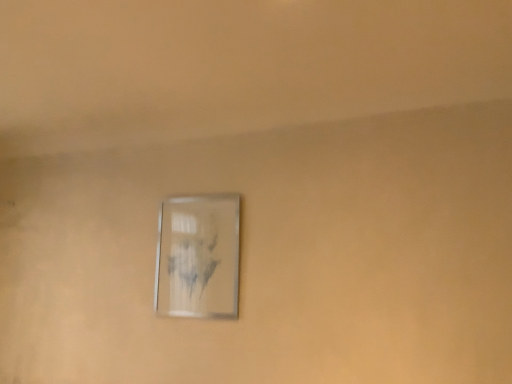
Image resolution: width=512 pixels, height=384 pixels. Describe the element at coordinates (198, 257) in the screenshot. I see `clear glass picture frame at center` at that location.

Find the location of a particular element. clear glass picture frame at center is located at coordinates (198, 257).

Identify the location of clear glass picture frame at center. The image size is (512, 384). (198, 257).